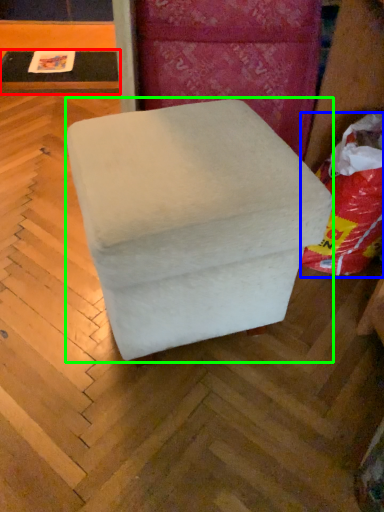
Question: Based on their relative distances, which object is nearer to table (highlighted by a red box)? Choose from bean bag chair (highlighted by a blue box) and furniture (highlighted by a green box).

Choices:
 (A) bean bag chair
 (B) furniture

Answer: (A)